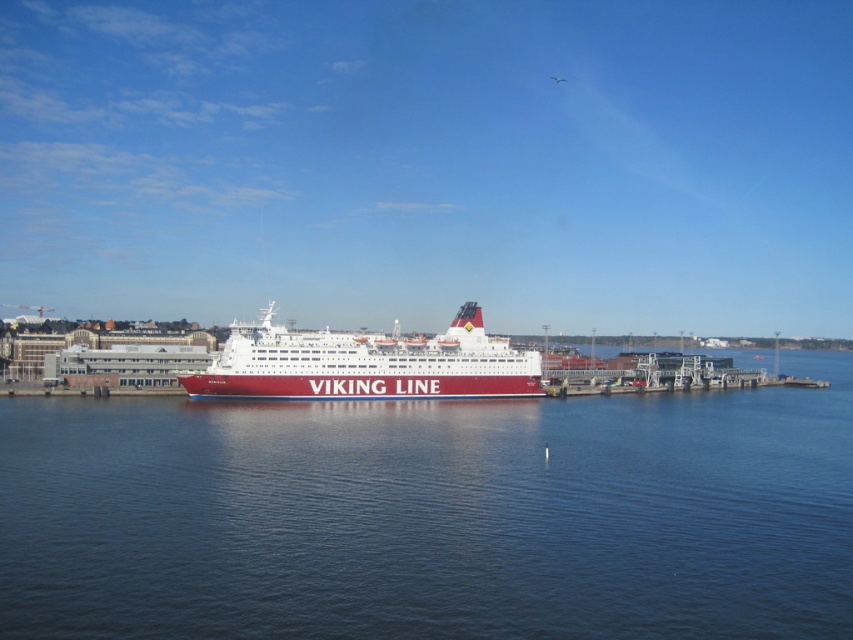
You are standing on the pier and looking at the blue water at center and the white glossy cruise ship at center. Which one is closer to you?

The blue water at center is closer to you because it is in front of the white glossy cruise ship at center.

You are a photographer planning to capture the entire white glossy cruise ship at center and the blue water at center in a single frame. Based on the scene, which of these two elements occupies a greater horizontal space in the image?

The blue water at center occupies a greater horizontal space because its width is larger than that of the white glossy cruise ship at center.

You are standing on the pier and see the blue water at center and the white glossy cruise ship at center. Which one is more to the right?

The blue water at center is positioned on the right side of the white glossy cruise ship at center, so the blue water at center is more to the right.